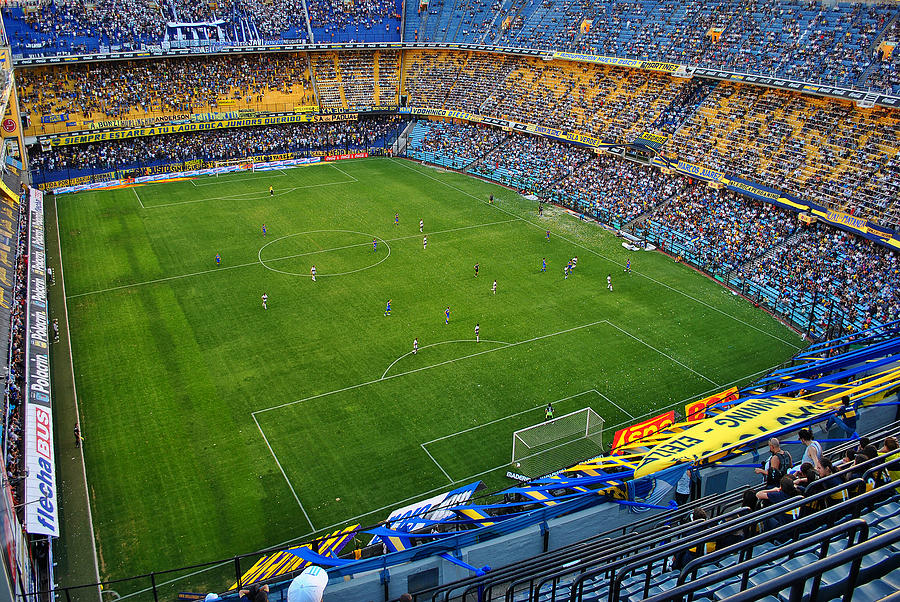
Find the location of `safety rail`. safety rail is located at coordinates (677, 550).